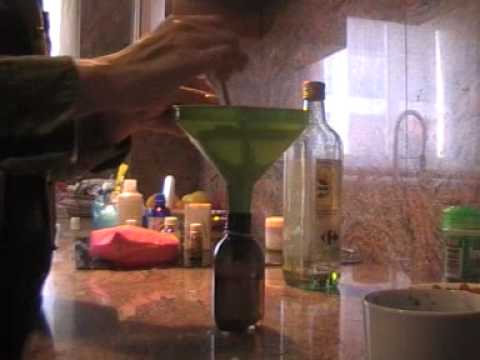
Locate an element on the screen. Image resolution: width=480 pixels, height=360 pixels. bowl is located at coordinates (418, 313).